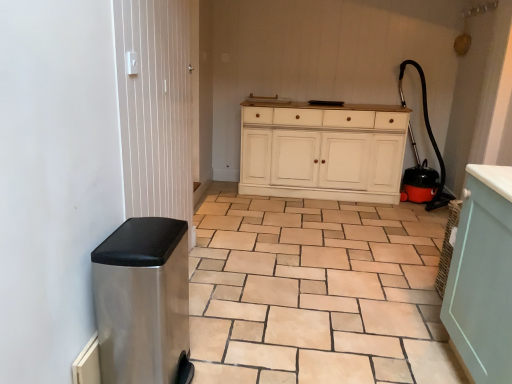
Identify the location of vacant space in front of white painted wood cabinet at center. This screenshot has height=384, width=512. (298, 228).